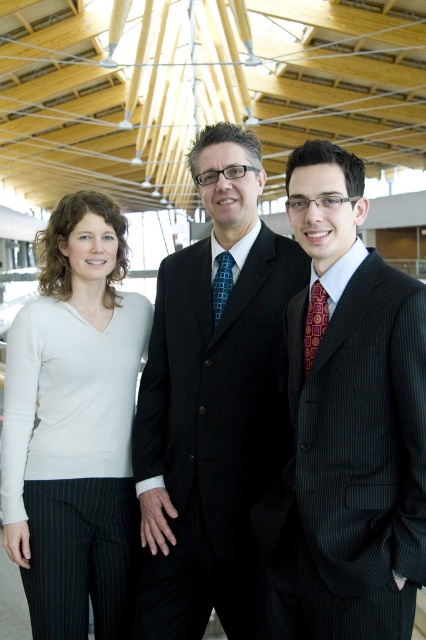
Who is positioned more to the right, black pinstripe suit at center or white matte sweater at left?

black pinstripe suit at center

Who is more forward, (244, 397) or (126, 573)?

Point (244, 397) is in front.

Does point (158, 404) come farther from viewer compared to point (66, 499)?

Yes, it is.

Find the location of a particular element. black pinstripe suit at center is located at coordinates (213, 401).

Which is behind, point (296, 493) or point (193, 433)?

Positioned behind is point (193, 433).

Does dark pinstripe suit at center have a smaller size compared to black pinstripe suit at center?

Yes.

Is point (414, 461) positioned before point (290, 288)?

Yes.

You are a GUI agent. You are given a task and a screenshot of the screen. Output one action in this format:
    pyautogui.click(x=<x>, y=<y>)
    Task: Click on the dark pinstripe suit at center
    The image size is (426, 640).
    Given the screenshot: What is the action you would take?
    pyautogui.click(x=348, y=422)

Can you confirm if dark pinstripe suit at center is shorter than white matte sweater at left?

Yes, dark pinstripe suit at center is shorter than white matte sweater at left.

Is dark pinstripe suit at center above white matte sweater at left?

Indeed, dark pinstripe suit at center is positioned over white matte sweater at left.

I want to click on dark pinstripe suit at center, so click(x=348, y=422).